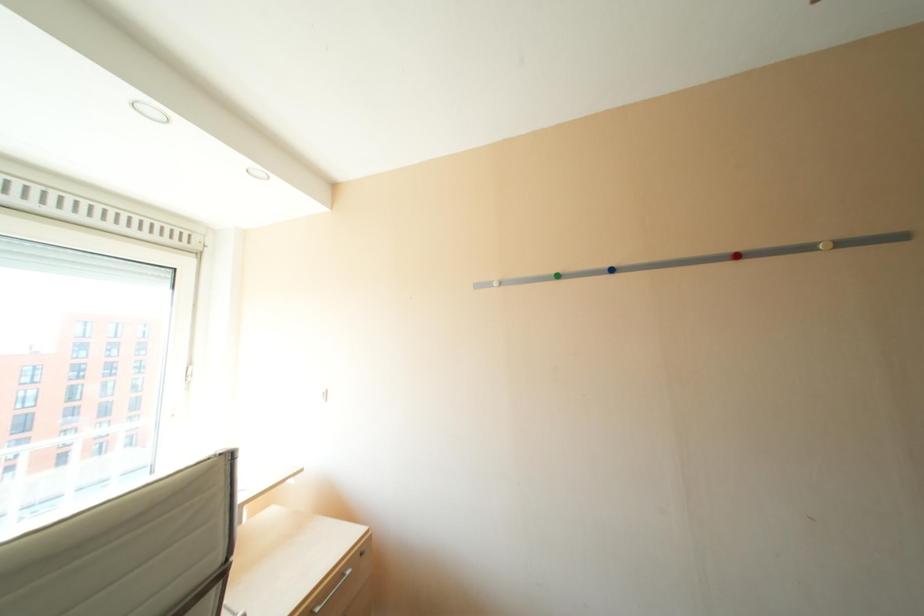
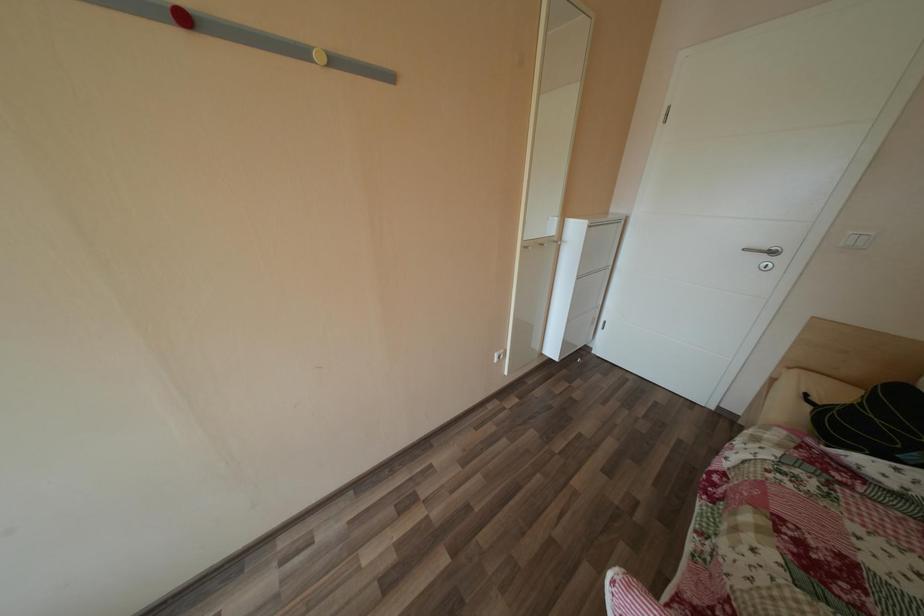
Based on the continuous images, in which direction is the camera rotating?

The camera's rotation is toward right-down.